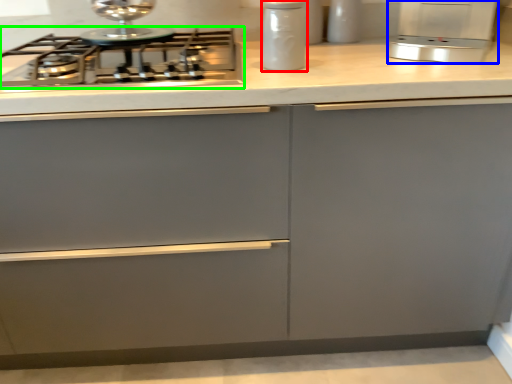
Question: Which is nearer to the kitchen appliance (highlighted by a red box)? kitchen appliance (highlighted by a blue box) or gas stove (highlighted by a green box).

Choices:
 (A) kitchen appliance
 (B) gas stove

Answer: (B)